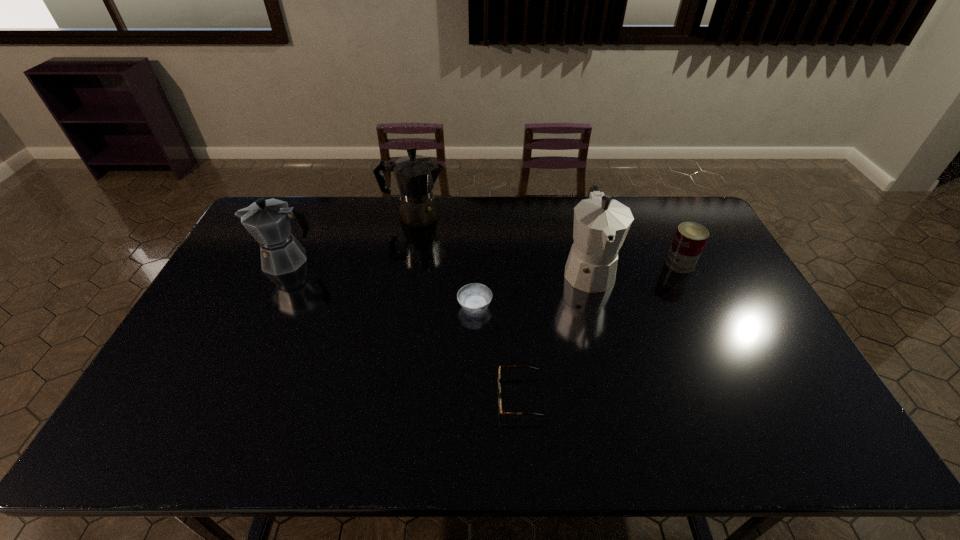
Image resolution: width=960 pixels, height=540 pixels. Find the location of `the rightmost coffeepot`. the rightmost coffeepot is located at coordinates (601, 224).

At what (x,y) coordinates should I click in order to perform the action: click on the second coffeepot from right to left. Please return your answer as a coordinate pair (x, y). Looking at the image, I should click on (415, 175).

Find the location of a particular element. the farthest coffeepot is located at coordinates (415, 175).

Image resolution: width=960 pixels, height=540 pixels. Identify the location of the shortest coffeepot. (268, 221).

In order to click on the leftmost object in this screenshot , I will do `click(268, 221)`.

This screenshot has height=540, width=960. In order to click on the fourth tallest object in this screenshot , I will do `click(690, 238)`.

Where is `can`? This screenshot has width=960, height=540. can is located at coordinates (690, 238).

Locate an element on the screen. The height and width of the screenshot is (540, 960). ashtray is located at coordinates (474, 298).

Find the location of a particular element. Image resolution: width=960 pixels, height=540 pixels. the nearest object is located at coordinates (499, 387).

Find the location of a particular element. This screenshot has height=540, width=960. spectacles is located at coordinates (499, 387).